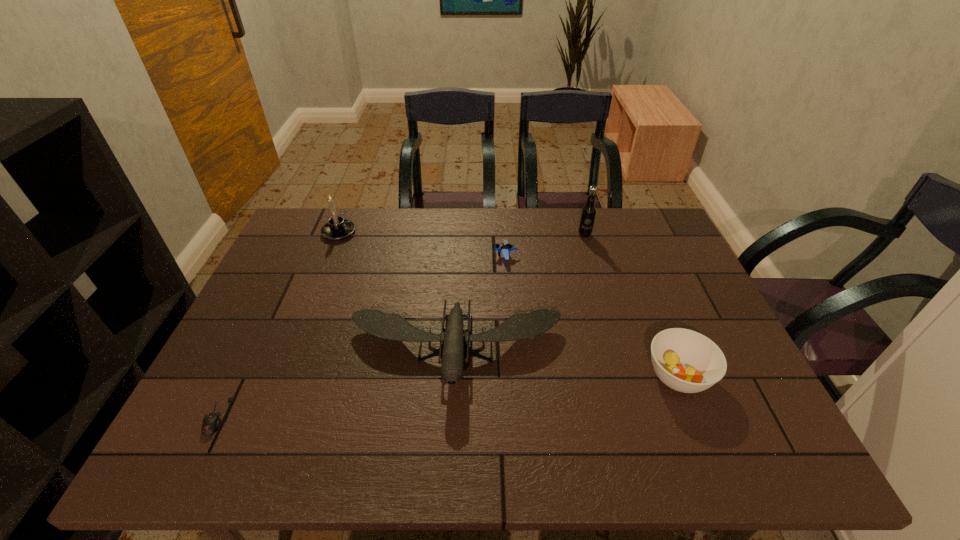
You are a GUI agent. You are given a task and a screenshot of the screen. Output one action in this format:
    pyautogui.click(x=<x>, y=<y>)
    Task: Click on the free location at the left edge
    
    Given the screenshot: What is the action you would take?
    pyautogui.click(x=255, y=376)

Image resolution: width=960 pixels, height=540 pixels. Find the location of `vacant space at the right edge of the desktop`. vacant space at the right edge of the desktop is located at coordinates (727, 346).

The image size is (960, 540). In order to click on free space at the far right corner of the desktop in this screenshot , I will do `click(653, 234)`.

Locate an element on the screen. The image size is (960, 540). blank region between the root beer and the Lego is located at coordinates click(545, 245).

You are a GUI agent. You are given a task and a screenshot of the screen. Output one action in this format:
    pyautogui.click(x=<x>, y=<y>)
    Task: Click on the free spot between the root beer and the Lego
    This screenshot has height=540, width=960.
    Given the screenshot: What is the action you would take?
    pyautogui.click(x=545, y=245)

Locate an element on the screen. Image resolution: width=960 pixels, height=540 pixels. free space between the Lego and the mouse is located at coordinates (362, 336).

This screenshot has height=540, width=960. Find the location of `free space between the fifth object from left to right and the soup bowl`. free space between the fifth object from left to right and the soup bowl is located at coordinates (632, 305).

Where is `vacant area that lies between the second shortest object and the third tallest object`? vacant area that lies between the second shortest object and the third tallest object is located at coordinates (481, 303).

I want to click on blank region between the drone and the fifth tallest object, so click(x=481, y=303).

Locate an element on the screen. The image size is (960, 540). free space that is in between the third shortest object and the shortest object is located at coordinates (448, 396).